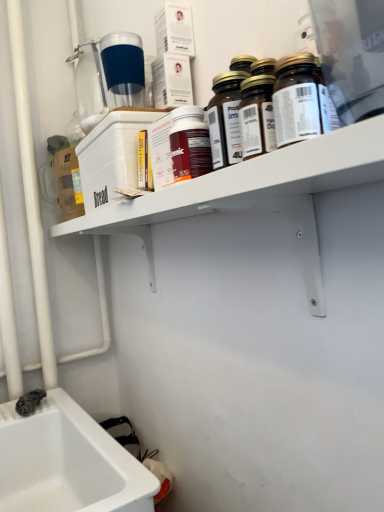
Question: Is point (241, 158) positioned closer to the camera than point (205, 131)?

Choices:
 (A) closer
 (B) farther

Answer: (A)

Question: Is translucent glass bottles at upper right, which ranks as the 3th bottle in back-to-front order, bigger or smaller than matte plastic bottle at center, which is the fourth bottle from front to back?

Choices:
 (A) big
 (B) small

Answer: (A)

Question: Considering the real-world distances, which object is closest to the white plastic shelf at upper center?

Choices:
 (A) brown glass bottle at upper center, the fifth bottle positioned from the back
 (B) translucent glass bottles at upper right, which ranks as the 3th bottle in back-to-front order
 (C) transparent plastic bottle at upper center, marked as the first bottle in a back-to-front arrangement
 (D) translucent glass bottles at upper center, the second bottle in the front-to-back sequence
 (E) matte plastic bottle at center, which ranks as the 2th bottle in back-to-front order

Answer: (E)

Question: Which object is the farthest from the translucent glass bottles at upper center, the second bottle in the front-to-back sequence?

Choices:
 (A) brown glass bottle at upper center, arranged as the first bottle when viewed from the front
 (B) white plastic shelf at upper center
 (C) matte plastic bottle at center, which is the fourth bottle from front to back
 (D) transparent plastic bottle at upper center, positioned as the fifth bottle in front-to-back order
 (E) translucent glass bottles at upper right, which ranks as the 3th bottle in back-to-front order

Answer: (D)